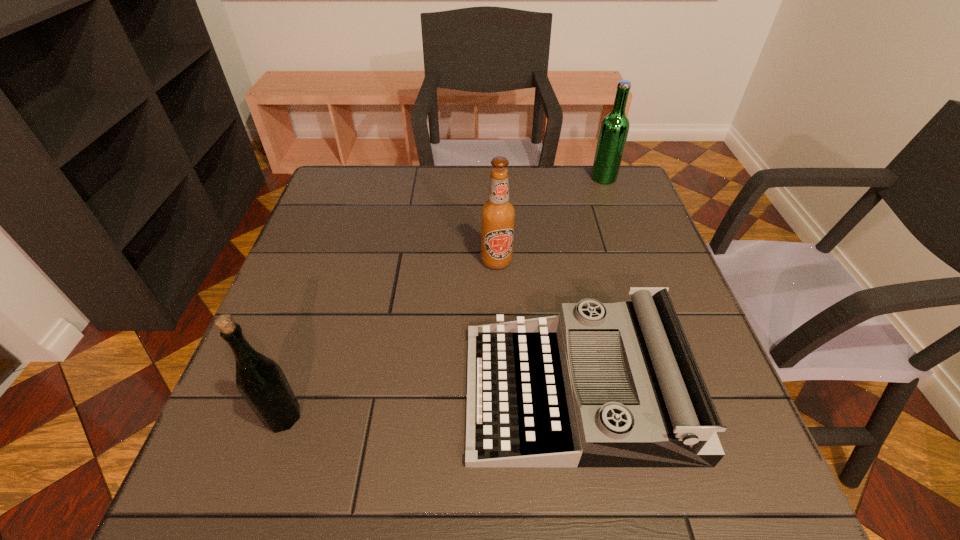
Identify the location of vacant area at the far edge of the desktop. This screenshot has height=540, width=960. (469, 167).

Locate an element on the screen. Image resolution: width=960 pixels, height=540 pixels. free location at the near edge is located at coordinates (390, 481).

Locate an element on the screen. This screenshot has height=540, width=960. vacant position at the left edge of the desktop is located at coordinates (336, 307).

Locate an element on the screen. The width and height of the screenshot is (960, 540). free spot at the far left corner of the desktop is located at coordinates (335, 190).

Where is `vacant space at the far right corner`? This screenshot has width=960, height=540. vacant space at the far right corner is located at coordinates (609, 202).

Identify the location of vacant region between the rightmost beer bottle and the nearest beer bottle. This screenshot has height=540, width=960. (444, 298).

I want to click on unoccupied position between the second farthest object and the farthest beer bottle, so pos(550,219).

Where is `empty space that is in between the leftmost object and the typewriter`? This screenshot has height=540, width=960. empty space that is in between the leftmost object and the typewriter is located at coordinates (430, 404).

Find the location of `unoccupied position between the farthest object and the shortest object`. unoccupied position between the farthest object and the shortest object is located at coordinates (590, 285).

Locate an element on the screen. The width and height of the screenshot is (960, 540). free space between the leftmost beer bottle and the typewriter is located at coordinates (430, 404).